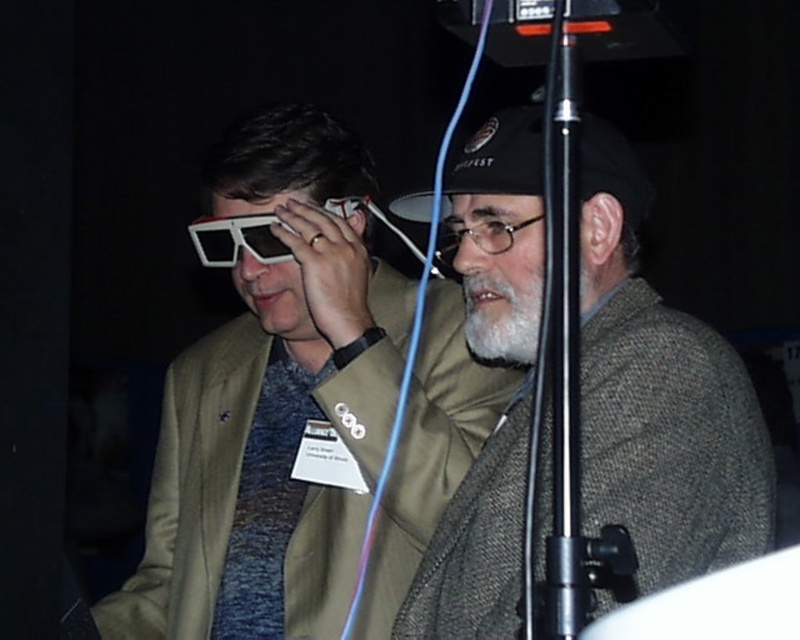
Question: Is the position of gray woolen sweater at center more distant than that of white fuzzy beard at center?

Choices:
 (A) no
 (B) yes

Answer: (A)

Question: Where is gray woolen sweater at center located in relation to white fuzzy beard at center in the image?

Choices:
 (A) right
 (B) left

Answer: (B)

Question: Which of the following is the closest to the observer?

Choices:
 (A) (358, 424)
 (B) (400, 232)
 (C) (425, 579)
 (D) (472, 310)

Answer: (C)

Question: Based on their relative distances, which object is nearer to the black matte microphone at center?

Choices:
 (A) matte white plastic glasses at center
 (B) clear plastic glasses at center
 (C) gray woolen sweater at center
 (D) white plastic goggles at center

Answer: (B)

Question: From the image, what is the correct spatial relationship of white plastic goggles at center in relation to black matte microphone at center?

Choices:
 (A) above
 (B) below

Answer: (B)

Question: Which point is closer to the camera?

Choices:
 (A) (488, 228)
 (B) (398, 234)

Answer: (A)